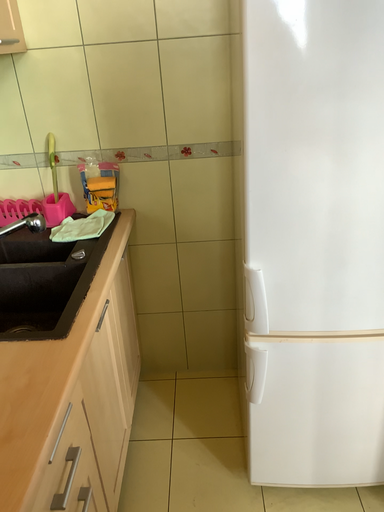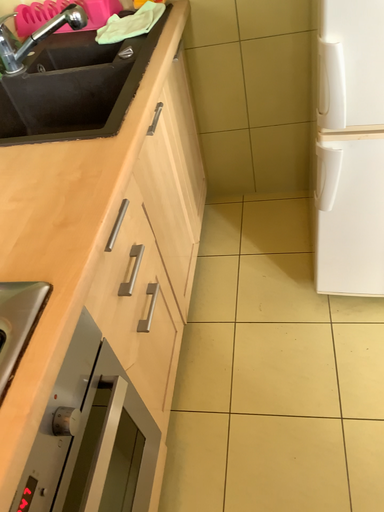
Question: How did the camera likely rotate when shooting the video?

Choices:
 (A) rotated upward
 (B) rotated downward

Answer: (B)